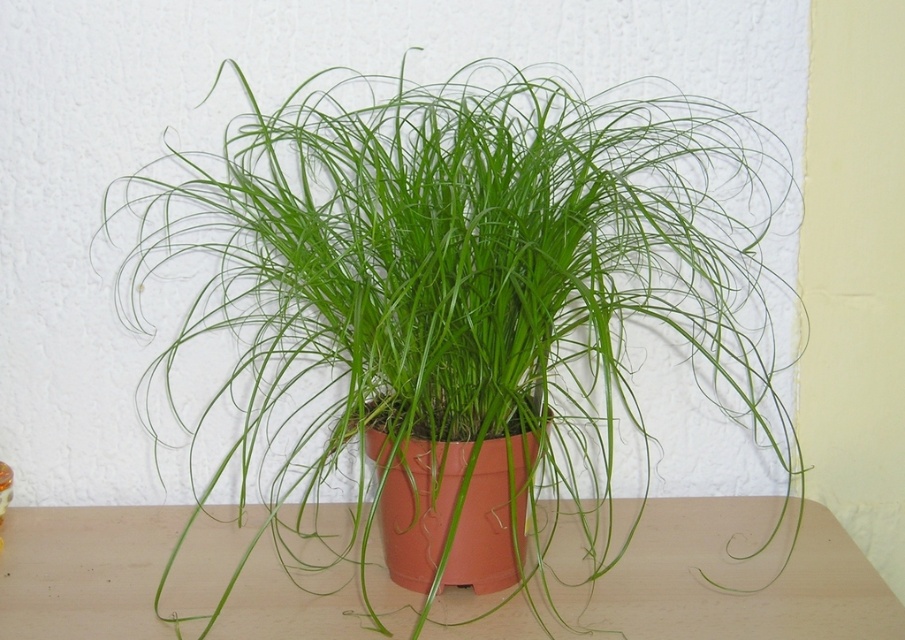
You are arranging a shelf and have the green glossy plant at center and the matte orange pot at center. Which object is more to the right?

The green glossy plant at center is positioned on the right side of the matte orange pot at center, so it is more to the right.

You are a florist arranging a display and need to ensure the green glossy plant at center is visible above the matte orange pot at center. Based on the scene, will the plant naturally be seen above the pot?

The green glossy plant at center has a greater height compared to the matte orange pot at center, so yes, the plant will naturally be seen above the pot.